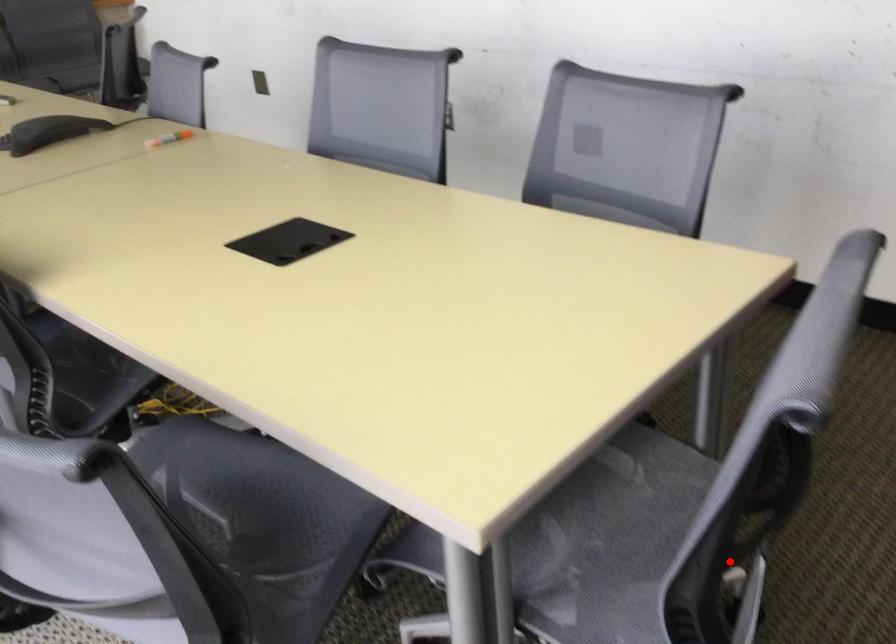
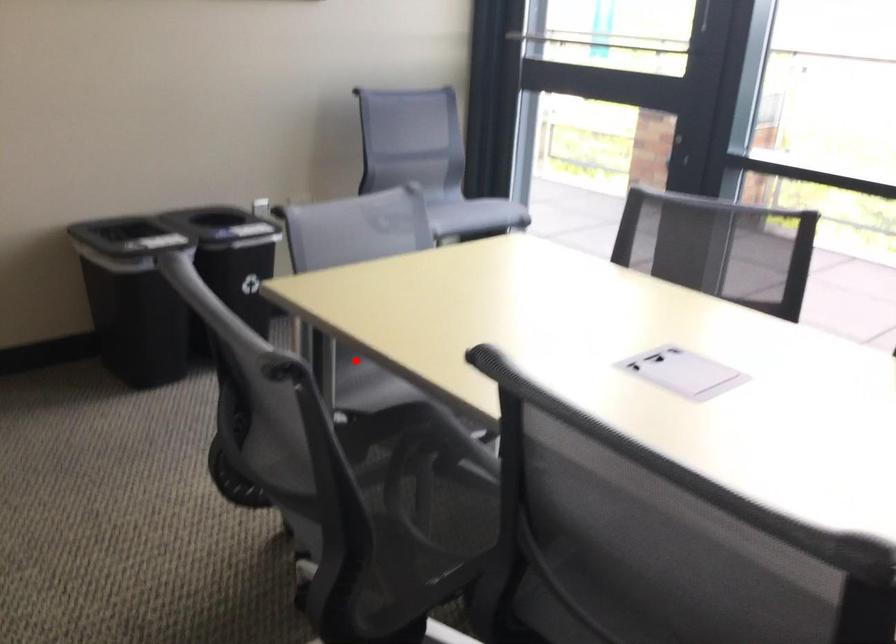
I am providing you with two images of the same scene from different viewpoints. A red point is marked on the first image and another point is marked on the second image. Is the red point in image1 aligned with the point shown in image2?

Yes